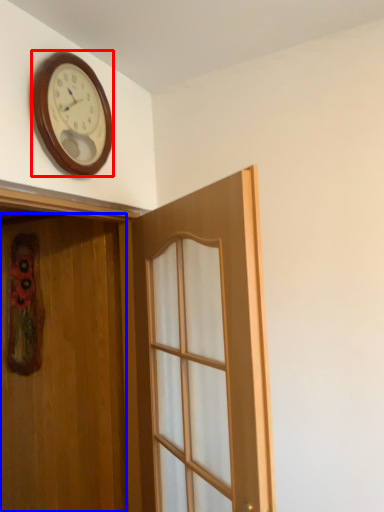
Question: Which point is further to the camera, wall clock (highlighted by a red box) or door (highlighted by a blue box)?

Choices:
 (A) wall clock
 (B) door

Answer: (A)